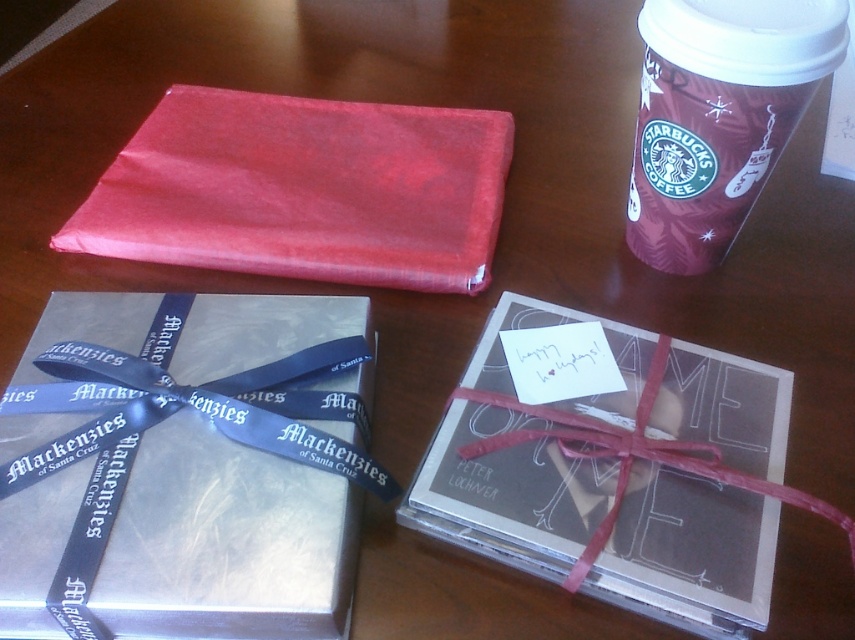
Question: Is silver metallic gift at center thinner than shiny red fabric at upper left?

Choices:
 (A) no
 (B) yes

Answer: (B)

Question: Is shiny red fabric at upper left above maroon paper cup at upper right?

Choices:
 (A) no
 (B) yes

Answer: (B)

Question: Considering the real-world distances, which object is farthest from the maroon paper cup at upper right?

Choices:
 (A) shiny red fabric at upper left
 (B) silver metallic gift at center

Answer: (B)

Question: Which point appears closest to the camera in this image?

Choices:
 (A) click(441, 259)
 (B) click(647, 124)

Answer: (B)

Question: Can you confirm if shiny red fabric at upper left is wider than maroon paper cup at upper right?

Choices:
 (A) no
 (B) yes

Answer: (B)

Question: Which point is farther to the camera?

Choices:
 (A) (438, 136)
 (B) (785, 68)
 (C) (162, 435)

Answer: (A)